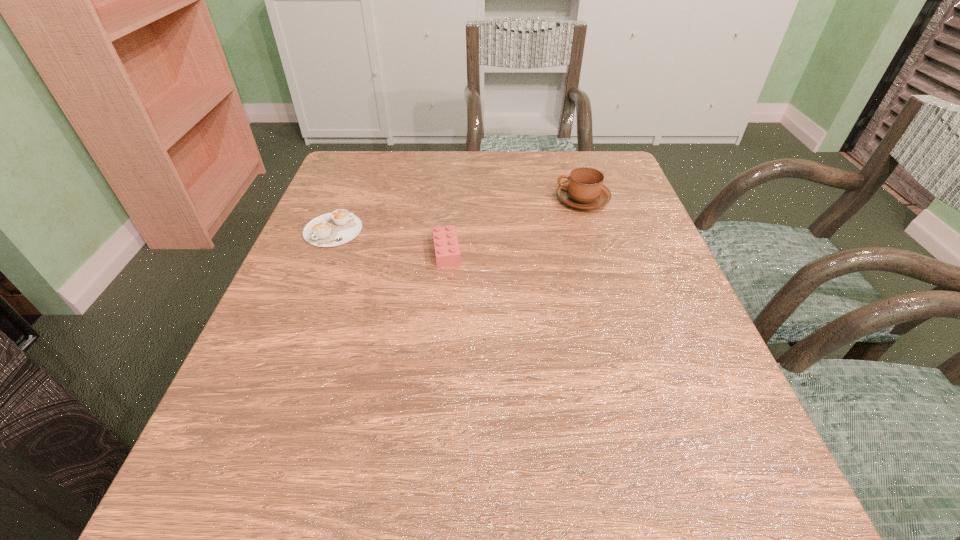
Where is `vacant region located 0.390m on the front of the shortest object`? The image size is (960, 540). vacant region located 0.390m on the front of the shortest object is located at coordinates (257, 419).

Locate an element on the screen. This screenshot has width=960, height=540. object present at the far edge is located at coordinates (584, 189).

Find the location of a particular element. object located at the left edge is located at coordinates (332, 229).

I want to click on object that is at the right edge, so click(x=584, y=189).

Where is `object that is at the far right corner`? The image size is (960, 540). object that is at the far right corner is located at coordinates (584, 189).

Image resolution: width=960 pixels, height=540 pixels. In the image, there is a desktop. Find the location of `vacant space at the near edge`. vacant space at the near edge is located at coordinates (456, 535).

In the image, there is a desktop. Where is `blank space at the left edge`? The width and height of the screenshot is (960, 540). blank space at the left edge is located at coordinates (330, 282).

In the image, there is a desktop. Find the location of `free space at the right edge`. free space at the right edge is located at coordinates (586, 212).

At what (x,y) coordinates should I click in order to perform the action: click on free space at the far left corner of the desktop. Please return your answer as a coordinate pair (x, y). The height and width of the screenshot is (540, 960). Looking at the image, I should click on (392, 162).

You are a GUI agent. You are given a task and a screenshot of the screen. Output one action in this format:
    pyautogui.click(x=<x>, y=<y>)
    Task: Click on the free region at the near left corner of the desktop
    Image resolution: width=960 pixels, height=540 pixels.
    Given the screenshot: What is the action you would take?
    pyautogui.click(x=288, y=490)